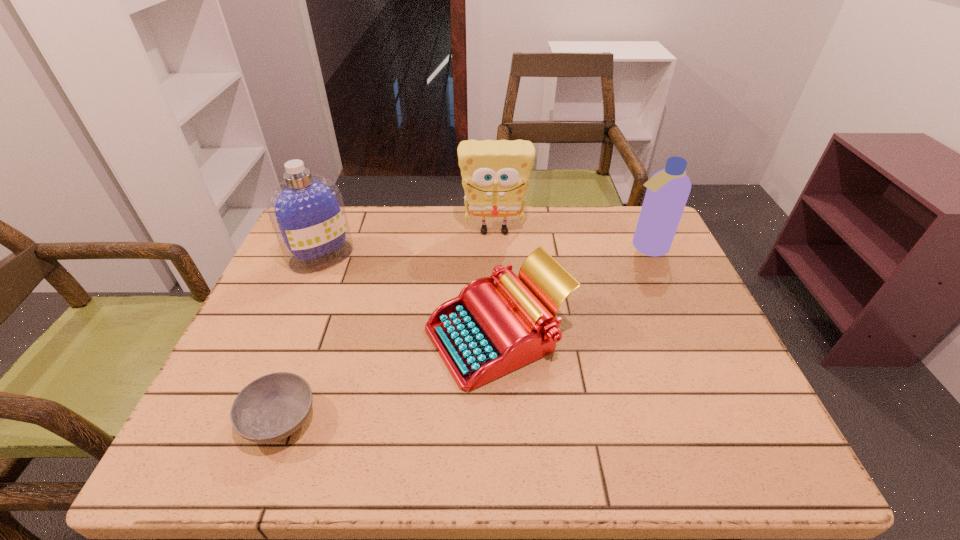
Image resolution: width=960 pixels, height=540 pixels. Identify the location of vacant space located on the typing side of the second shortest object. (302, 336).

Identify the location of free space located on the back of the shortest object. The image size is (960, 540). (322, 307).

Where is `cleansing agent located in the far edge section of the desktop`? cleansing agent located in the far edge section of the desktop is located at coordinates (306, 210).

Where is `shampoo present at the far edge`? The image size is (960, 540). shampoo present at the far edge is located at coordinates (667, 192).

The height and width of the screenshot is (540, 960). In order to click on sponge at the far edge in this screenshot , I will do `click(495, 174)`.

The image size is (960, 540). Find the location of `object that is positioned at the near edge`. object that is positioned at the near edge is located at coordinates (272, 407).

Identify the location of cleansing agent present at the left edge. This screenshot has height=540, width=960. (306, 210).

This screenshot has height=540, width=960. In order to click on bowl that is at the left edge in this screenshot , I will do point(272,407).

Where is `object at the right edge`? This screenshot has height=540, width=960. object at the right edge is located at coordinates (667, 192).

Find the location of a particular element. The height and width of the screenshot is (540, 960). object at the far left corner is located at coordinates (306, 210).